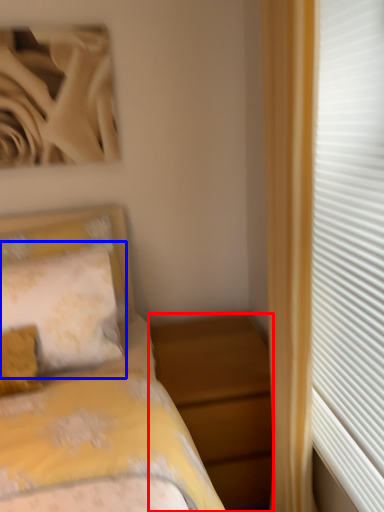
Question: Which object is closer to the camera taking this photo, nightstand (highlighted by a red box) or pillow (highlighted by a blue box)?

Choices:
 (A) nightstand
 (B) pillow

Answer: (A)